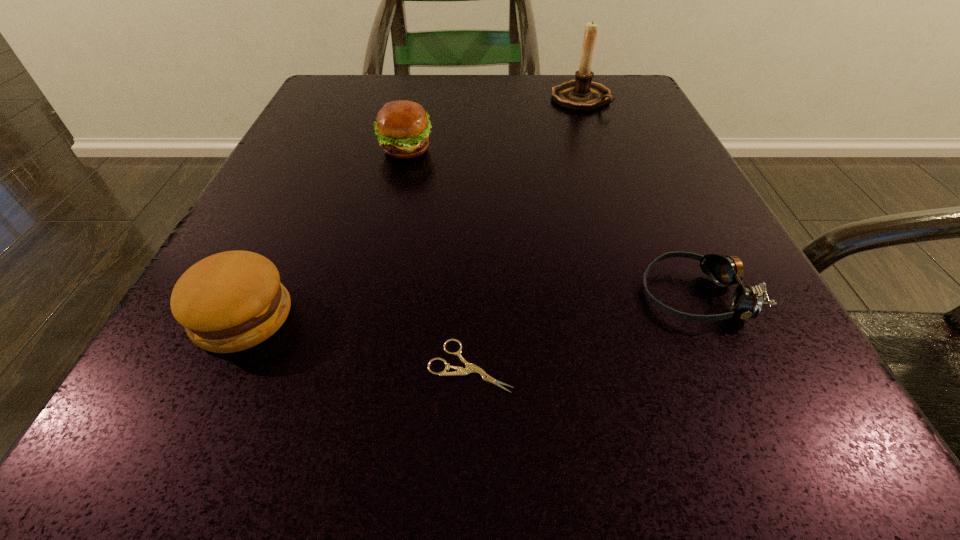
The height and width of the screenshot is (540, 960). What are the coordinates of `free space between the tallest object and the second farthest object` in the screenshot? It's located at (492, 124).

Where is `empty space between the candle holder and the goggles`? The image size is (960, 540). empty space between the candle holder and the goggles is located at coordinates (637, 197).

Where is `free point between the third object from right to left and the farthest object`? The height and width of the screenshot is (540, 960). free point between the third object from right to left and the farthest object is located at coordinates (525, 232).

Image resolution: width=960 pixels, height=540 pixels. In order to click on blank region between the third object from left to right and the leftmost object in this screenshot , I will do pos(357,341).

At what (x,y) coordinates should I click in order to perform the action: click on unoccupied area between the second farthest object and the candle holder. Please return your answer as a coordinate pair (x, y). The width and height of the screenshot is (960, 540). Looking at the image, I should click on (492, 124).

Find the location of a particular element. This screenshot has width=960, height=540. free spot between the nearer hamburger and the fourth nearest object is located at coordinates (324, 233).

You are a GUI agent. You are given a task and a screenshot of the screen. Output one action in this format:
    pyautogui.click(x=<x>, y=<y>)
    Task: Click on the free spot between the left hamburger and the tallest object
    
    Given the screenshot: What is the action you would take?
    pyautogui.click(x=412, y=207)

Find the location of `vacant space that is in between the goggles and the nearer hamburger`. vacant space that is in between the goggles and the nearer hamburger is located at coordinates (469, 306).

Locate an element on the screen. This screenshot has width=960, height=540. object that ranks as the closest to the goggles is located at coordinates (470, 368).

Select which object is the third closest to the fourth tallest object. Please provide its 2D coordinates. Your answer should be formatted as a tuple, i.e. [(x, y)], where the tuple contains the x and y coordinates of a point satisfying the conditions above.

[(231, 301)]